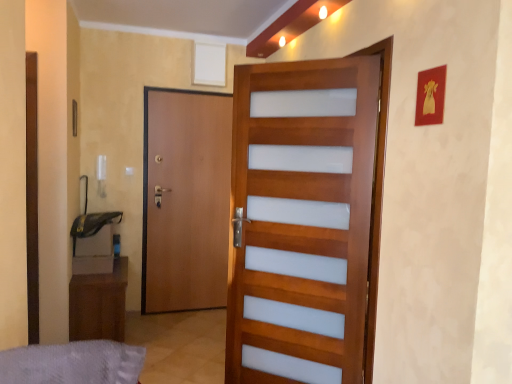
Image resolution: width=512 pixels, height=384 pixels. Identify the location of brown wood door at left, which is the 2th door from front to back. (185, 200).

Image resolution: width=512 pixels, height=384 pixels. What do you see at coordinates (73, 363) in the screenshot?
I see `gray fabric bed at lower left` at bounding box center [73, 363].

The height and width of the screenshot is (384, 512). What do you see at coordinates (99, 304) in the screenshot?
I see `brown wood cabinet at lower left` at bounding box center [99, 304].

The width and height of the screenshot is (512, 384). What do you see at coordinates (301, 220) in the screenshot?
I see `wooden door with frosted panels at center, acting as the 1th door starting from the right` at bounding box center [301, 220].

Where is `brown wood door at left, which is the 1th door from back to front`? brown wood door at left, which is the 1th door from back to front is located at coordinates (185, 200).

Does brown wood cabinet at lower left have a greater width compared to brown wood door at left, placed as the 2th door when sorted from right to left?

Indeed, brown wood cabinet at lower left has a greater width compared to brown wood door at left, placed as the 2th door when sorted from right to left.

Looking at this image, is brown wood cabinet at lower left bigger or smaller than brown wood door at left, placed as the 2th door when sorted from right to left?

brown wood cabinet at lower left is bigger than brown wood door at left, placed as the 2th door when sorted from right to left.

Looking at this image, choose the correct answer: Is brown wood cabinet at lower left inside brown wood door at left, placed as the 2th door when sorted from right to left, or outside it?

brown wood cabinet at lower left is not inside brown wood door at left, placed as the 2th door when sorted from right to left, it's outside.

Measure the distance between brown wood cabinet at lower left and brown wood door at left, which is the 1th door from back to front.

35.82 inches.

Is brown wood cabinet at lower left touching wooden door with frosted panels at center, acting as the 1th door starting from the right?

No, brown wood cabinet at lower left is not making contact with wooden door with frosted panels at center, acting as the 1th door starting from the right.

Considering the sizes of objects brown wood cabinet at lower left and wooden door with frosted panels at center, the 1th door in the front-to-back sequence, in the image provided, who is wider, brown wood cabinet at lower left or wooden door with frosted panels at center, the 1th door in the front-to-back sequence,?

With larger width is brown wood cabinet at lower left.

From the image's perspective, is brown wood cabinet at lower left above or below wooden door with frosted panels at center, which is the second door from left to right?

Based on their image positions, brown wood cabinet at lower left is located beneath wooden door with frosted panels at center, which is the second door from left to right.

From the image's perspective, is brown wood door at left, which is the 2th door from front to back, located above wooden door with frosted panels at center, the 1th door in the front-to-back sequence?

Correct, brown wood door at left, which is the 2th door from front to back, appears higher than wooden door with frosted panels at center, the 1th door in the front-to-back sequence, in the image.

Is brown wood door at left, placed as the 2th door when sorted from right to left, bigger or smaller than wooden door with frosted panels at center, acting as the 1th door starting from the right?

Considering their sizes, brown wood door at left, placed as the 2th door when sorted from right to left, takes up less space than wooden door with frosted panels at center, acting as the 1th door starting from the right.

Who is more distant, brown wood door at left, which is the 2th door from front to back, or wooden door with frosted panels at center, which appears as the second door when viewed from the back?

brown wood door at left, which is the 2th door from front to back, is behind.

Is brown wood door at left, placed as the 2th door when sorted from right to left, not within wooden door with frosted panels at center, which is the second door from left to right?

Absolutely, brown wood door at left, placed as the 2th door when sorted from right to left, is external to wooden door with frosted panels at center, which is the second door from left to right.

From the image's perspective, which door is the 1st one above the gray fabric bed at lower left? Please provide its 2D coordinates.

[(301, 220)]

Between gray fabric bed at lower left and wooden door with frosted panels at center, which is the second door from left to right, which one has more height?

wooden door with frosted panels at center, which is the second door from left to right.

Is gray fabric bed at lower left in front of or behind wooden door with frosted panels at center, which is the second door from left to right, in the image?

gray fabric bed at lower left is positioned closer to the viewer than wooden door with frosted panels at center, which is the second door from left to right.

Could you tell me if brown wood cabinet at lower left is turned towards gray fabric bed at lower left?

No, brown wood cabinet at lower left is not facing towards gray fabric bed at lower left.

In terms of height, does brown wood cabinet at lower left look taller or shorter compared to gray fabric bed at lower left?

Clearly, brown wood cabinet at lower left is taller compared to gray fabric bed at lower left.

Locate an element on the screen. The image size is (512, 384). furniture behind the gray fabric bed at lower left is located at coordinates (99, 304).

How different are the orientations of wooden door with frosted panels at center, which appears as the second door when viewed from the back, and gray fabric bed at lower left in degrees?

The angular difference between wooden door with frosted panels at center, which appears as the second door when viewed from the back, and gray fabric bed at lower left is 157 degrees.

Measure the distance from wooden door with frosted panels at center, which appears as the second door when viewed from the back, to gray fabric bed at lower left.

wooden door with frosted panels at center, which appears as the second door when viewed from the back, is 1.42 meters from gray fabric bed at lower left.

Which is more to the right, wooden door with frosted panels at center, which appears as the second door when viewed from the back, or gray fabric bed at lower left?

From the viewer's perspective, wooden door with frosted panels at center, which appears as the second door when viewed from the back, appears more on the right side.

Does wooden door with frosted panels at center, the 1th door in the front-to-back sequence, have a lesser width compared to gray fabric bed at lower left?

Indeed, wooden door with frosted panels at center, the 1th door in the front-to-back sequence, has a lesser width compared to gray fabric bed at lower left.

From a real-world perspective, is brown wood door at left, which ranks as the first door in left-to-right order, over brown wood cabinet at lower left?

Yes, from a real-world perspective, brown wood door at left, which ranks as the first door in left-to-right order, is above brown wood cabinet at lower left.

Choose the correct answer: Is brown wood door at left, which is the 2th door from front to back, inside brown wood cabinet at lower left or outside it?

brown wood door at left, which is the 2th door from front to back, is spatially situated outside brown wood cabinet at lower left.

Does brown wood door at left, which is the 2th door from front to back, have a greater width compared to brown wood cabinet at lower left?

Incorrect, the width of brown wood door at left, which is the 2th door from front to back, does not surpass that of brown wood cabinet at lower left.

Locate an element on the screen. This screenshot has height=384, width=512. the 1st door to the right of the brown wood cabinet at lower left, starting your count from the anchor is located at coordinates (185, 200).

Identify the location of furniture to the left of wooden door with frosted panels at center, which is the second door from left to right. coord(99,304).

Which object lies nearer to the anchor point brown wood door at left, placed as the 2th door when sorted from right to left, wooden door with frosted panels at center, which appears as the second door when viewed from the back, or gray fabric bed at lower left?

Based on the image, wooden door with frosted panels at center, which appears as the second door when viewed from the back, appears to be nearer to brown wood door at left, placed as the 2th door when sorted from right to left.

Considering their positions, is brown wood cabinet at lower left positioned closer to gray fabric bed at lower left than brown wood door at left, which is the 2th door from front to back?

brown wood cabinet at lower left lies closer to gray fabric bed at lower left than the other object.

When comparing their distances from brown wood cabinet at lower left, does wooden door with frosted panels at center, which appears as the second door when viewed from the back, or brown wood door at left, which ranks as the first door in left-to-right order, seem closer?

Based on the image, brown wood door at left, which ranks as the first door in left-to-right order, appears to be nearer to brown wood cabinet at lower left.

Based on the photo, when comparing their distances from gray fabric bed at lower left, does brown wood cabinet at lower left or wooden door with frosted panels at center, acting as the 1th door starting from the right, seem further?

brown wood cabinet at lower left.

Looking at the image, which one is located further to wooden door with frosted panels at center, the 1th door in the front-to-back sequence, brown wood door at left, which is the 1th door from back to front, or gray fabric bed at lower left?

brown wood door at left, which is the 1th door from back to front.

When comparing their distances from gray fabric bed at lower left, does wooden door with frosted panels at center, which appears as the second door when viewed from the back, or brown wood cabinet at lower left seem closer?

wooden door with frosted panels at center, which appears as the second door when viewed from the back.

Which object lies further to the anchor point wooden door with frosted panels at center, which is the second door from left to right, gray fabric bed at lower left or brown wood cabinet at lower left?

The object further to wooden door with frosted panels at center, which is the second door from left to right, is brown wood cabinet at lower left.

When comparing their distances from wooden door with frosted panels at center, which is the second door from left to right, does brown wood cabinet at lower left or gray fabric bed at lower left seem closer?

gray fabric bed at lower left lies closer to wooden door with frosted panels at center, which is the second door from left to right, than the other object.

What are the coordinates of `furniture positioned between gray fabric bed at lower left and brown wood door at left, which ranks as the first door in left-to-right order, from near to far` in the screenshot? It's located at (99, 304).

Locate an element on the screen. door between gray fabric bed at lower left and brown wood cabinet at lower left from front to back is located at coordinates (301, 220).

Where is `furniture positioned between wooden door with frosted panels at center, acting as the 1th door starting from the right, and brown wood door at left, which is the 1th door from back to front, from near to far`? This screenshot has width=512, height=384. furniture positioned between wooden door with frosted panels at center, acting as the 1th door starting from the right, and brown wood door at left, which is the 1th door from back to front, from near to far is located at coordinates pos(99,304).

What are the coordinates of `door between gray fabric bed at lower left and brown wood door at left, placed as the 2th door when sorted from right to left, along the z-axis` in the screenshot? It's located at (301, 220).